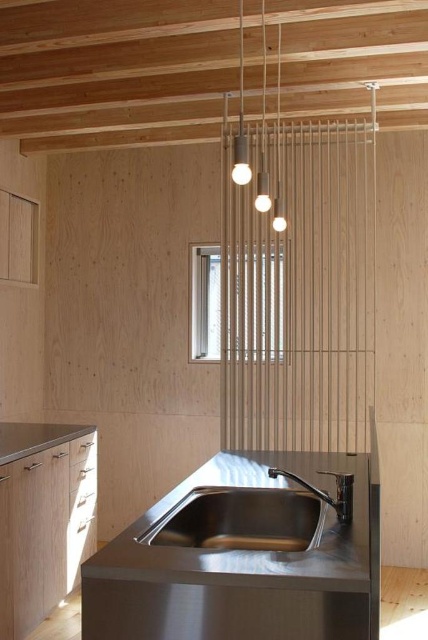
You are a delivery person who just arrived at the kitchen to install a new exhaust hood. The current exhaust hood is located at point (115,68). Can you confirm the exact coordinates of the matte wood exhaust hood at upper center?

The matte wood exhaust hood at upper center is located at point (115,68).

You are planning to install a new kitchen appliance that requires a surface area of 1.2 square meters. You have two options in the scene to place it on or under. The options are the matte wood exhaust hood at upper center and the stainless steel sink at center. Which of these two options can accommodate the appliance based on their sizes?

The matte wood exhaust hood at upper center has a larger size compared to the stainless steel sink at center, so it can accommodate the appliance requiring 1.2 square meters.